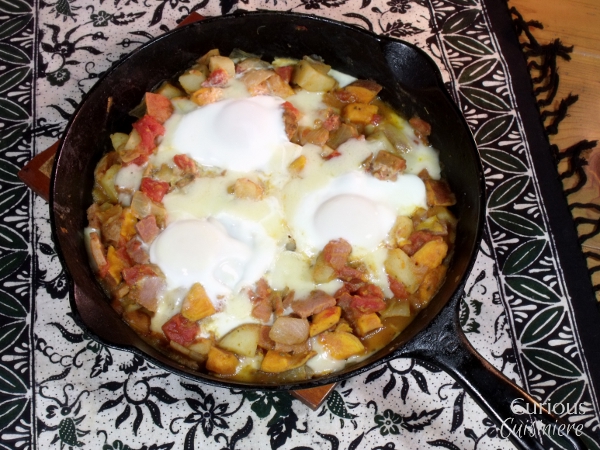
Identify the location of trivet. (317, 398).